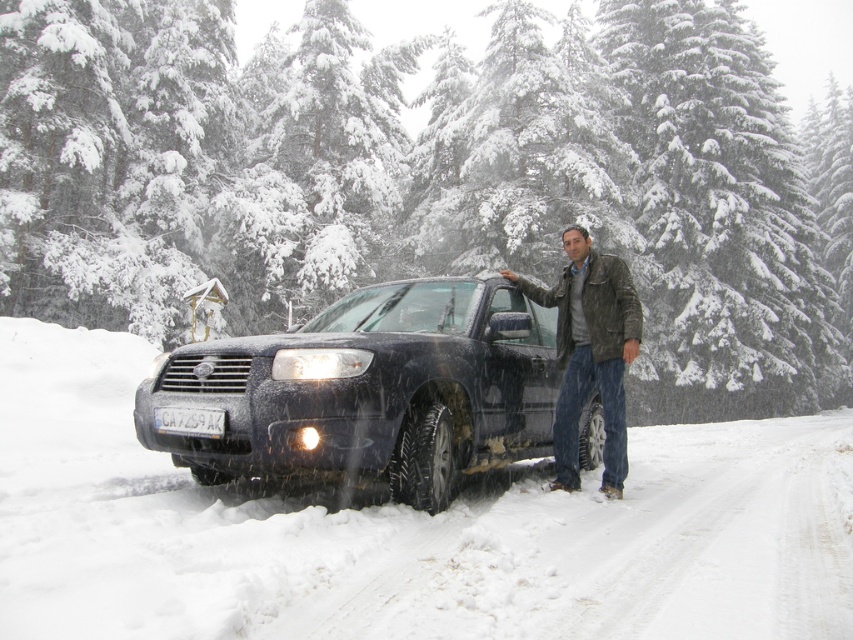
Based on the photo, you are a photographer trying to capture the snowy scene. You want to place your tripod at the point where the white powdery snow at center is located. Given that the tripod requires a flat surface, can you confirm if the area at point (404,531) is suitable?

The area at point (404,531) has white powdery snow at center, which is a flat surface. Therefore, the tripod can be placed there.

You are a photographer trying to capture the entire scene in one shot. Given that the matte black suv at center is smaller than the white powdery snow at center, which object should you focus on to ensure both are visible in the frame?

Since the white powdery snow at center is bigger than the matte black suv at center, you should focus on the white powdery snow at center to ensure both objects are visible in the frame.

You are a photographer trying to capture a shot of the man and the SUV in the snowy scene. If you want to ensure both the white powdery snow at center and the leather jacket at center are in focus, what should you consider about their distance?

The white powdery snow at center is 4.58 meters away from the leather jacket at center. To ensure both are in focus, the photographer should use a small aperture or a higher fstop number to increase the depth of field, allowing both objects at different distances to be sharp.